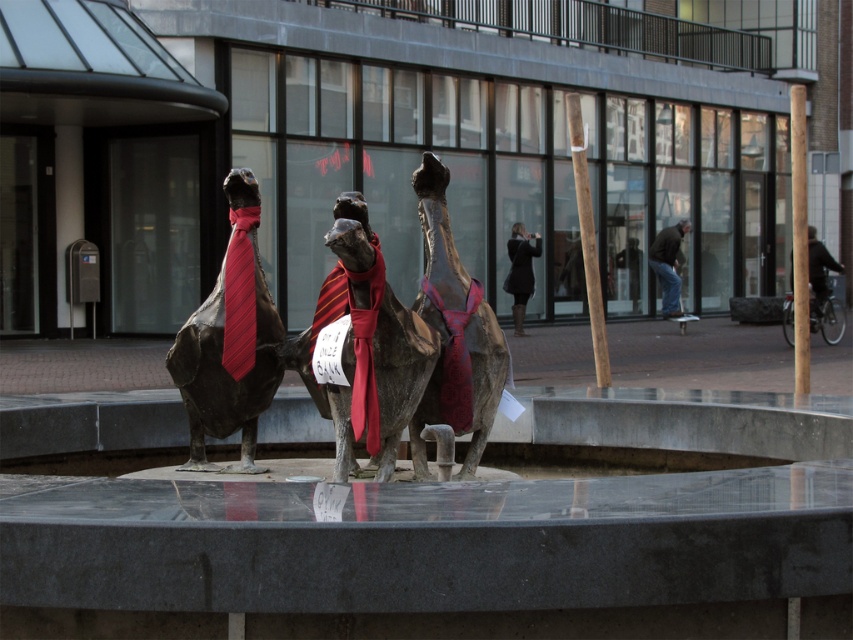
Is shiny bronze camel at center wider than dark brown leather jacket at center?

No.

This screenshot has height=640, width=853. I want to click on shiny bronze camel at center, so click(367, 348).

Looking at this image, measure the distance between point [337,449] and camera.

They are 5.91 meters apart.

This screenshot has width=853, height=640. Identify the location of shiny bronze camel at center. (367, 348).

Locate an element on the screen. The width and height of the screenshot is (853, 640). shiny bronze camel at center is located at coordinates (367, 348).

The width and height of the screenshot is (853, 640). In order to click on shiny bronze camel at center in this screenshot , I will do `click(367, 348)`.

Find the location of a particular element. The image size is (853, 640). shiny bronze camel at center is located at coordinates (367, 348).

Between point (184, 323) and point (654, 262), which one is positioned behind?

Positioned behind is point (654, 262).

Does point (251, 202) come closer to viewer compared to point (664, 228)?

That is True.

Locate an element on the screen. This screenshot has height=640, width=853. shiny bronze statue at center is located at coordinates (229, 340).